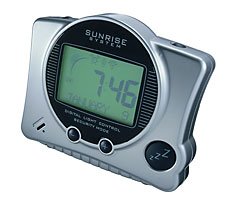
This screenshot has height=200, width=250. Identify the location of display screen. (80, 78).